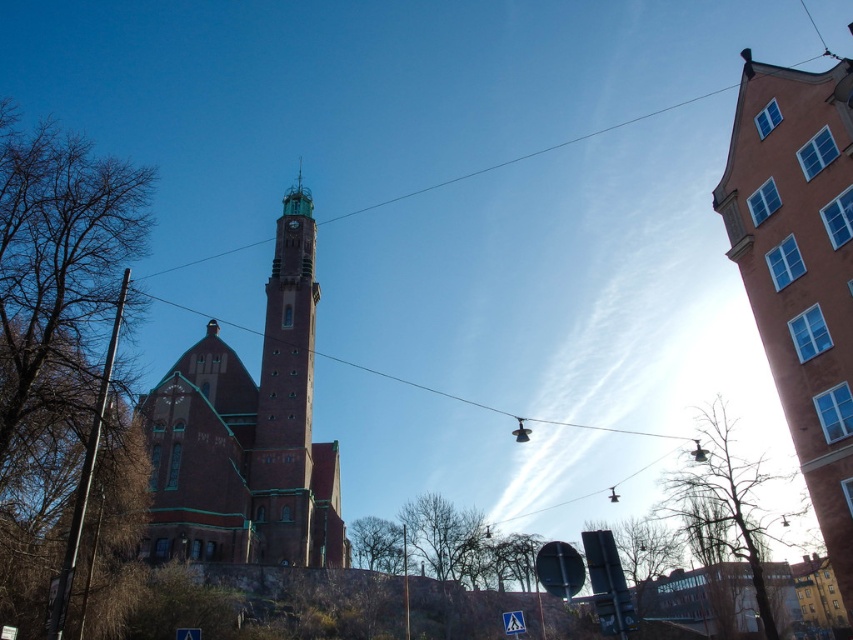
Between terracotta brick church at upper right and greenish-brown stone clock tower at center-left, which one is positioned lower?

terracotta brick church at upper right

Is point (799, 250) more distant than point (294, 228)?

No.

Describe the element at coordinates (799, 268) in the screenshot. I see `terracotta brick church at upper right` at that location.

Find the location of `terracotta brick church at upper right`. terracotta brick church at upper right is located at coordinates (799, 268).

Is the position of brick church at center less distant than that of greenish-brown stone clock tower at center-left?

Yes, brick church at center is in front of greenish-brown stone clock tower at center-left.

Looking at this image, between brick church at center and greenish-brown stone clock tower at center-left, which one is positioned higher?

greenish-brown stone clock tower at center-left is higher up.

Where is `brick church at center`? The image size is (853, 640). brick church at center is located at coordinates [x=248, y=433].

Does terracotta brick church at upper right have a lesser height compared to brick church at center?

Result: Incorrect, terracotta brick church at upper right's height does not fall short of brick church at center's.

Which is behind, point (836, 68) or point (161, 486)?

The point (161, 486) is more distant.

Where is `terracotta brick church at upper right`? The height and width of the screenshot is (640, 853). terracotta brick church at upper right is located at coordinates (799, 268).